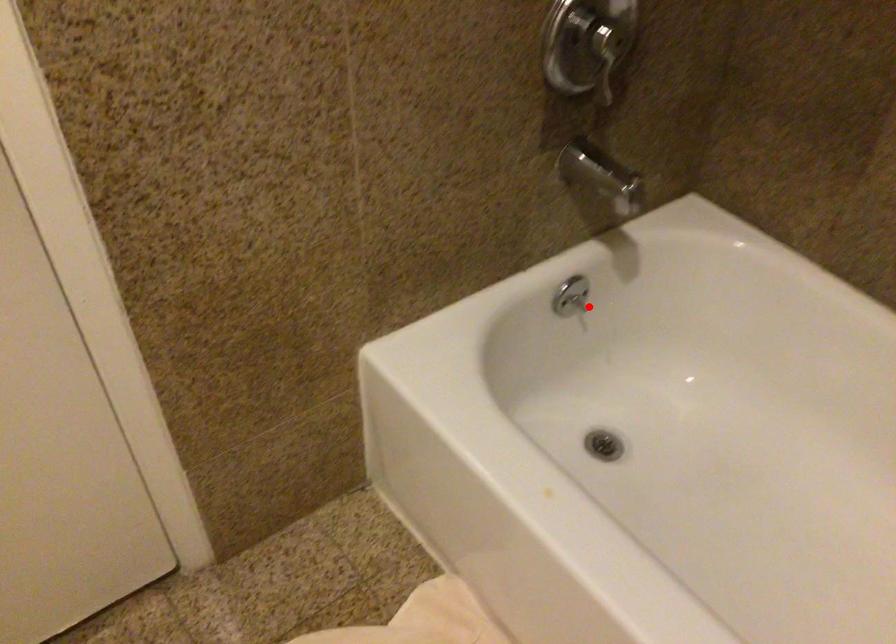
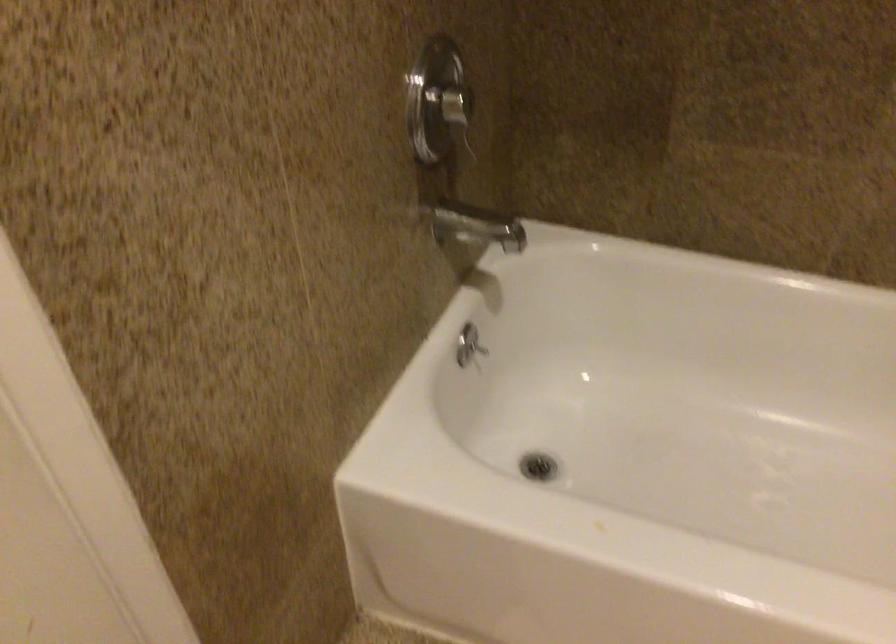
Question: I am providing you with two images of the same scene from different viewpoints. A red point is marked on the first image. At the location where the point appears in image 1, is it still visible in image 2?

Choices:
 (A) Yes
 (B) No

Answer: (A)